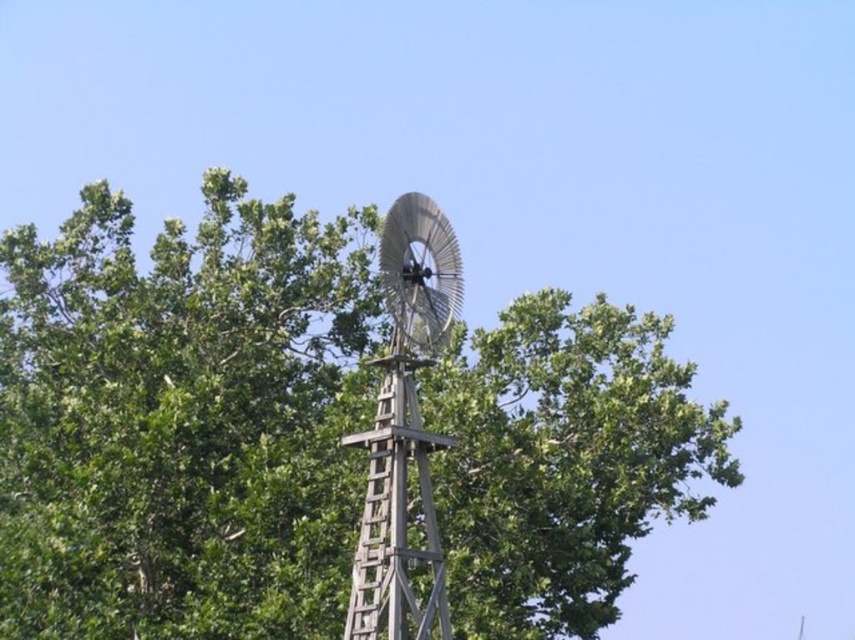
Which is more to the right, green leafy tree at center or wooden windmill at center?

wooden windmill at center is more to the right.

Can you confirm if green leafy tree at center is positioned to the right of wooden windmill at center?

In fact, green leafy tree at center is to the left of wooden windmill at center.

Between point (121, 220) and point (428, 288), which one is positioned behind?

Point (121, 220)

Where is `green leafy tree at center`? Image resolution: width=855 pixels, height=640 pixels. green leafy tree at center is located at coordinates (181, 420).